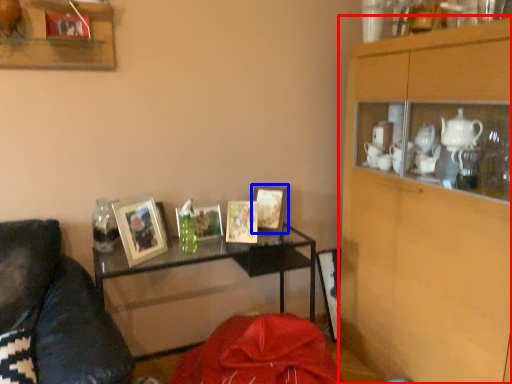
Question: Which object is further to the camera taking this photo, cabinetry (highlighted by a red box) or picture frame (highlighted by a blue box)?

Choices:
 (A) cabinetry
 (B) picture frame

Answer: (B)